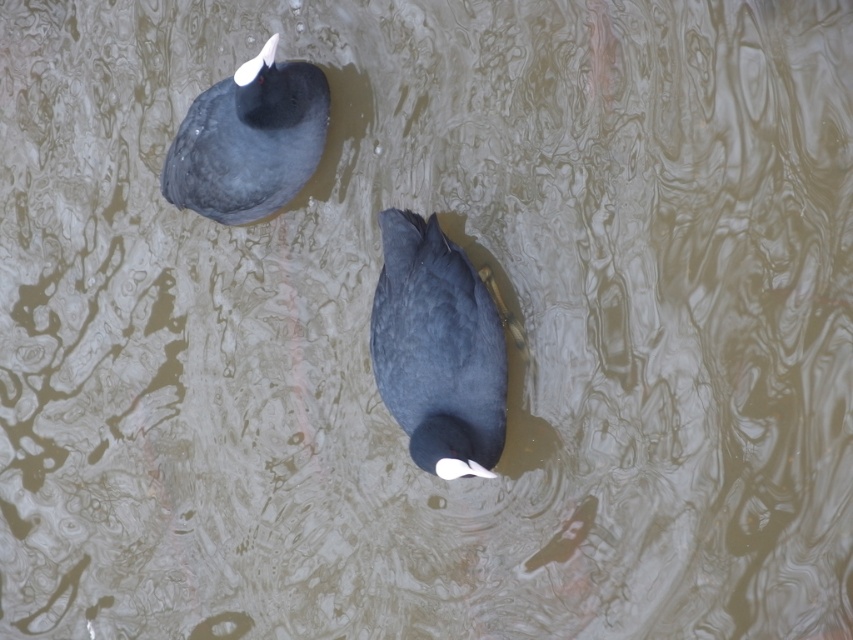
Question: Which object appears farthest from the camera in this image?

Choices:
 (A) matte black duck at upper left
 (B) matte black duck at center

Answer: (A)

Question: Considering the relative positions of matte black duck at center and matte black duck at upper left in the image provided, where is matte black duck at center located with respect to matte black duck at upper left?

Choices:
 (A) below
 (B) above

Answer: (A)

Question: Is matte black duck at center smaller than matte black duck at upper left?

Choices:
 (A) no
 (B) yes

Answer: (B)

Question: Is matte black duck at center to the right of matte black duck at upper left from the viewer's perspective?

Choices:
 (A) no
 (B) yes

Answer: (B)